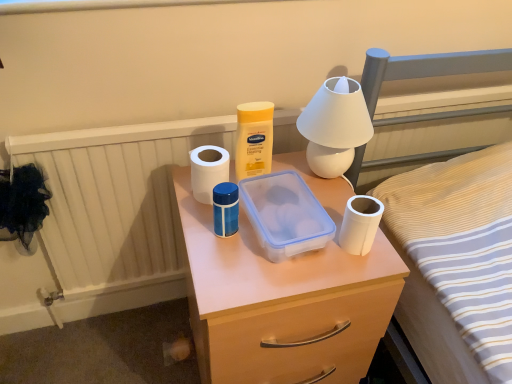
At what (x,y) coordinates should I click in order to perform the action: click on free space to the left of transparent plastic container at center. Please return your answer as a coordinate pair (x, y). Looking at the image, I should click on click(x=202, y=230).